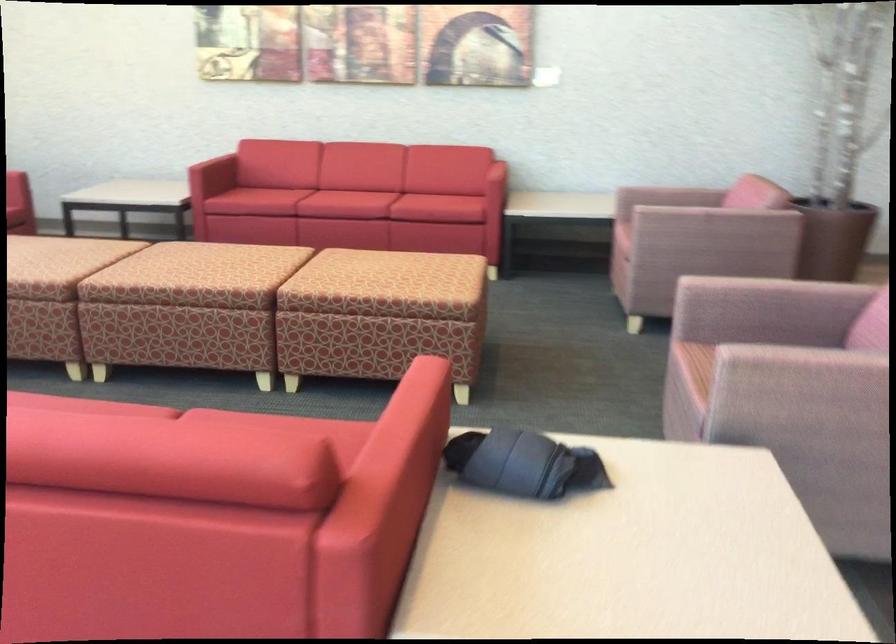
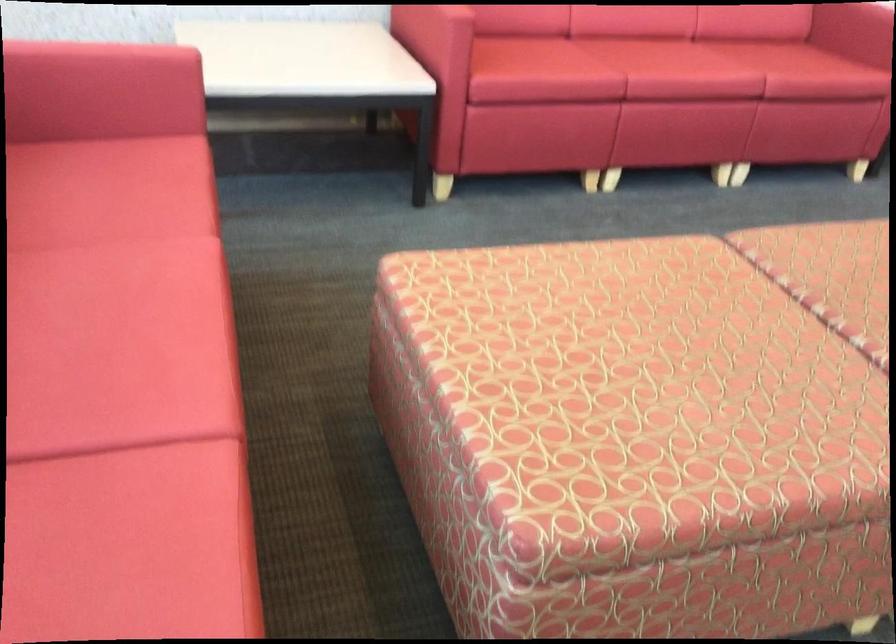
Locate, in the second image, the point that corresponds to point 348,180 in the first image.

(677, 62)